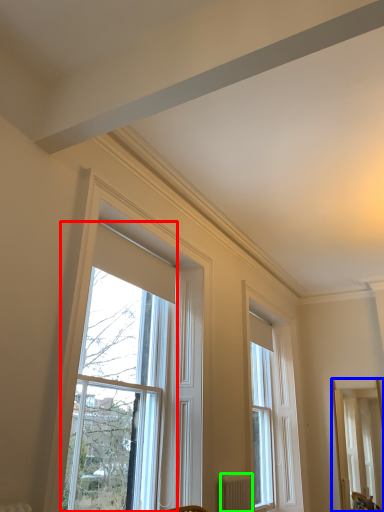
Question: Which is nearer to the window (highlighted by a red box)? mirror (highlighted by a blue box) or radiator (highlighted by a green box).

Choices:
 (A) mirror
 (B) radiator

Answer: (B)